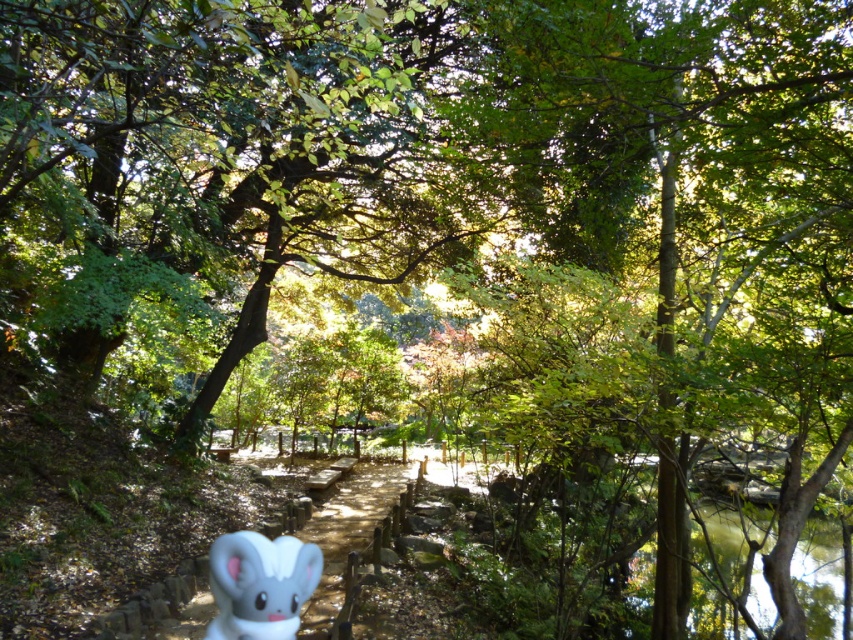
You are a child who wants to place a small toy on top of the wooden at center and the white matte bunny at lower center. Which object can you place the toy on without it falling off?

The wooden at center has a greater height compared to the white matte bunny at lower center, so you can place the toy on the wooden at center without it falling off.

You are a child visiting the park and see the wooden at center and the white matte bunny at lower center. Which object is wider?

The wooden at center is wider than the white matte bunny at lower center.